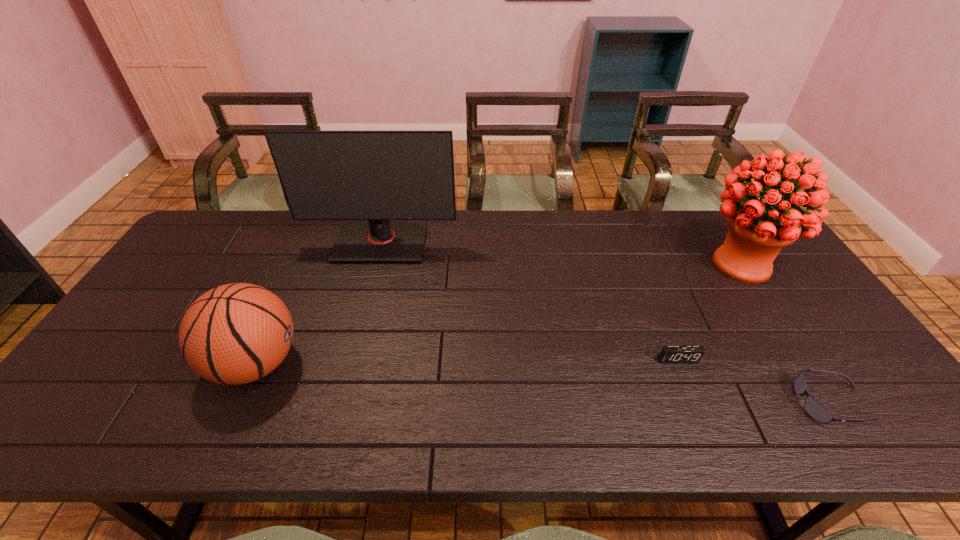
Locate an element on the screen. The image size is (960, 540). free spot at the near edge of the desktop is located at coordinates pos(269,411).

Where is `vacant area at the left edge`? This screenshot has width=960, height=540. vacant area at the left edge is located at coordinates (125, 386).

Identify the location of free space at the far left corner of the desktop. (245, 213).

Locate an element on the screen. The width and height of the screenshot is (960, 540). free spot between the monitor and the alarm clock is located at coordinates (529, 301).

At what (x,y) coordinates should I click in order to perform the action: click on free space that is in between the alarm clock and the bouquet. Please return your answer as a coordinate pair (x, y). The width and height of the screenshot is (960, 540). Looking at the image, I should click on (709, 312).

Identify the location of vacant region between the third shortest object and the third object from left to right. (467, 361).

At what (x,y) coordinates should I click in order to perform the action: click on vacant space in between the monitor and the sunglasses. Please return your answer as a coordinate pair (x, y). Looking at the image, I should click on (606, 323).

Locate an element on the screen. This screenshot has width=960, height=540. free space that is in between the third tallest object and the monitor is located at coordinates (318, 303).

The width and height of the screenshot is (960, 540). I want to click on vacant area that lies between the sunglasses and the bouquet, so click(x=786, y=333).

Image resolution: width=960 pixels, height=540 pixels. I want to click on free point between the monitor and the basketball, so click(x=318, y=303).